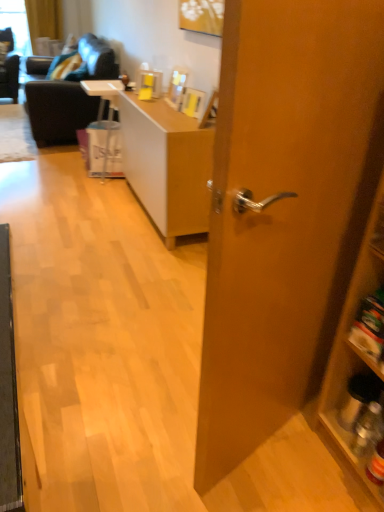
The height and width of the screenshot is (512, 384). I want to click on vacant space to the left of wooden door at center, so click(x=137, y=406).